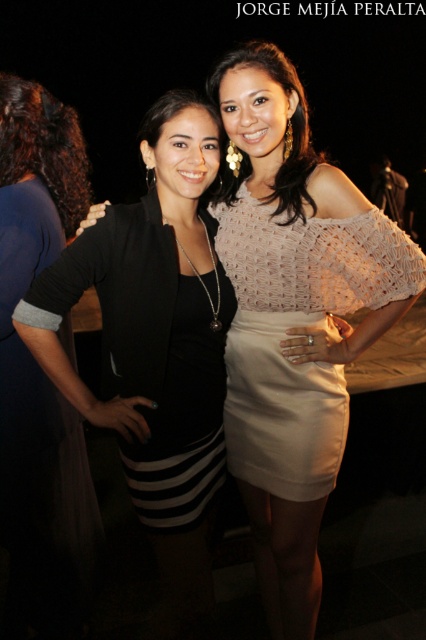
Describe the element at coordinates (40, 368) in the screenshot. The width and height of the screenshot is (426, 640). I see `black matte dress at left` at that location.

Is black matte dress at left positioned in front of white crochet dress at center?

No, it is not.

Does point (86, 566) come behind point (287, 278)?

Yes, it is.

The height and width of the screenshot is (640, 426). Identify the location of black matte dress at left. (40, 368).

Does white crochet dress at center have a greater height compared to dark brown curly hair at left?

Correct, white crochet dress at center is much taller as dark brown curly hair at left.

Is point (236, 408) farther from viewer compared to point (71, 186)?

No, (236, 408) is in front of (71, 186).

What do you see at coordinates (296, 324) in the screenshot? I see `white crochet dress at center` at bounding box center [296, 324].

In order to click on white crochet dress at center in this screenshot , I will do `click(296, 324)`.

Is black matte dress at left closer to camera compared to dark brown curly hair at left?

Yes, it is.

Is point (80, 524) positioned after point (23, 160)?

Yes, it is behind point (23, 160).

Does point (48, 486) lie behind point (55, 128)?

No.

Where is `black matte dress at left`? The height and width of the screenshot is (640, 426). black matte dress at left is located at coordinates (40, 368).